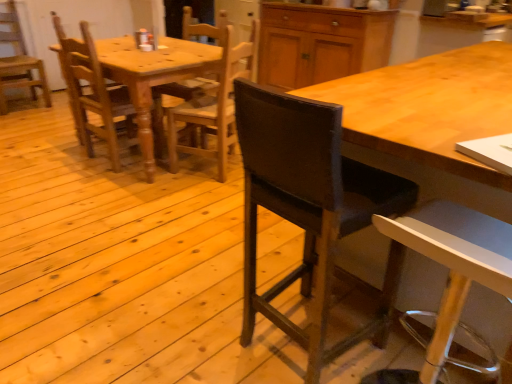
I want to click on free space that is to the left of dark brown leather chair at center, acting as the fourth chair starting from the back, so [x=193, y=328].